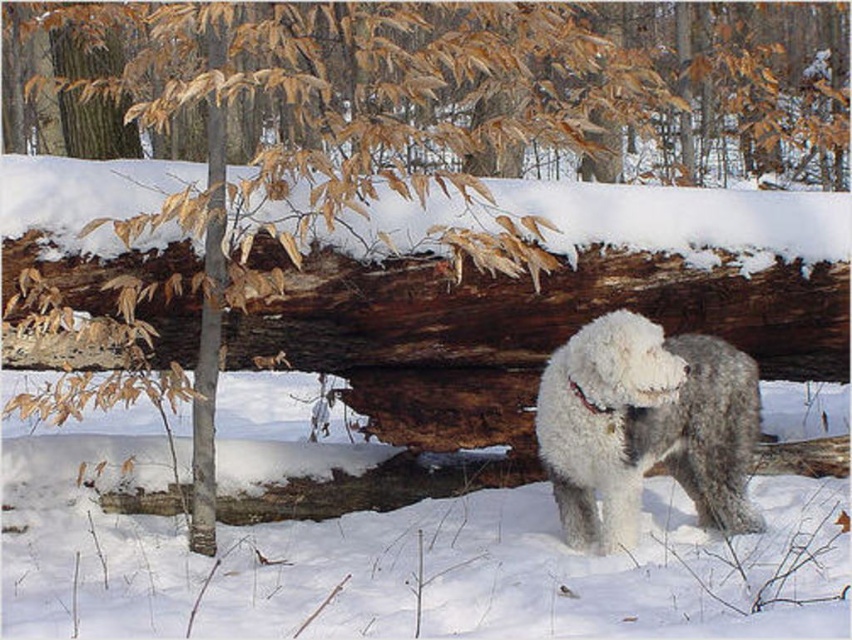
Question: Is rough bark log at center smaller than white fluffy dog at center?

Choices:
 (A) yes
 (B) no

Answer: (B)

Question: Can you confirm if rough bark log at center is thinner than white fluffy dog at center?

Choices:
 (A) no
 (B) yes

Answer: (A)

Question: Is rough bark log at center thinner than white fluffy dog at center?

Choices:
 (A) yes
 (B) no

Answer: (B)